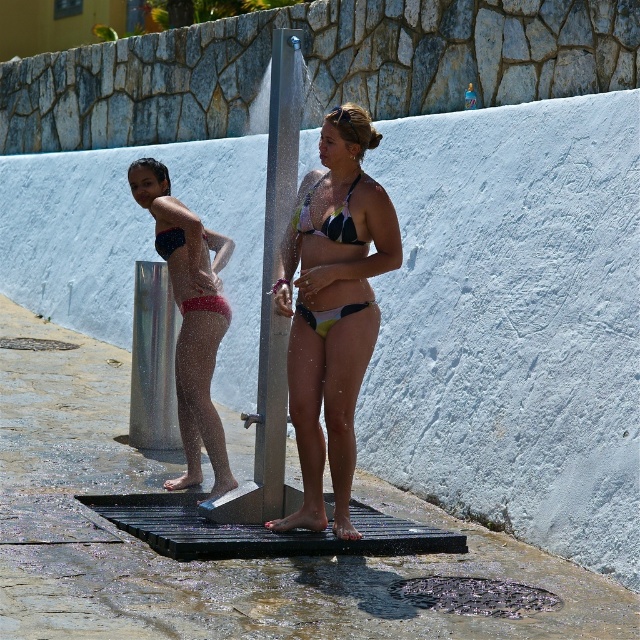
Between matte black bikini at left and matte black bikini top at center, which one has more height?

With more height is matte black bikini at left.

This screenshot has height=640, width=640. What do you see at coordinates (189, 317) in the screenshot?
I see `matte black bikini at left` at bounding box center [189, 317].

Which is behind, point (195, 240) or point (298, 211)?

The point (195, 240) is more distant.

Locate an element on the screen. The width and height of the screenshot is (640, 640). matte black bikini at left is located at coordinates (189, 317).

Which is in front, point (342, 476) or point (355, 234)?

Point (355, 234) is in front.

Does matte green bikini at center lie behind matte black bikini top at center?

No, it is in front of matte black bikini top at center.

Based on the photo, measure the distance between point (317,467) and camera.

11.71 meters

The height and width of the screenshot is (640, 640). I want to click on matte green bikini at center, so click(332, 308).

Does silver metallic pole at center have a greater width compared to matte black bikini top at center?

Indeed, silver metallic pole at center has a greater width compared to matte black bikini top at center.

Does point (269, 360) come farther from viewer compared to point (307, 193)?

Yes, point (269, 360) is behind point (307, 193).

The image size is (640, 640). Find the location of `silver metallic pole at center`. silver metallic pole at center is located at coordinates (275, 276).

At what (x,y) coordinates should I click in order to perform the action: click on silver metallic pole at center. Please return your answer as a coordinate pair (x, y). This screenshot has height=640, width=640. Looking at the image, I should click on [275, 276].